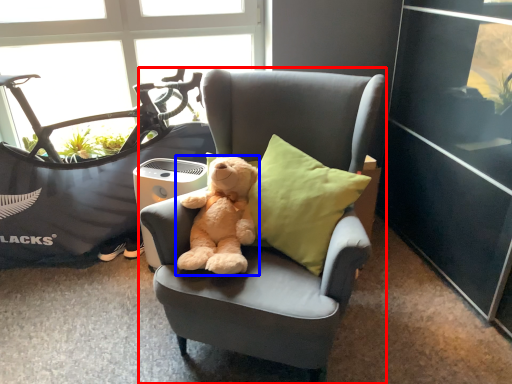
Question: Which of the following is the farthest to the observer, chair (highlighted by a red box) or teddy bear (highlighted by a blue box)?

Choices:
 (A) chair
 (B) teddy bear

Answer: (B)